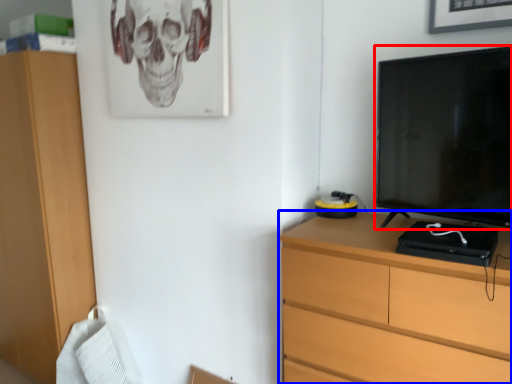
Question: Which object appears closest to the camera in this image, television (highlighted by a red box) or chest of drawers (highlighted by a blue box)?

Choices:
 (A) television
 (B) chest of drawers

Answer: (B)